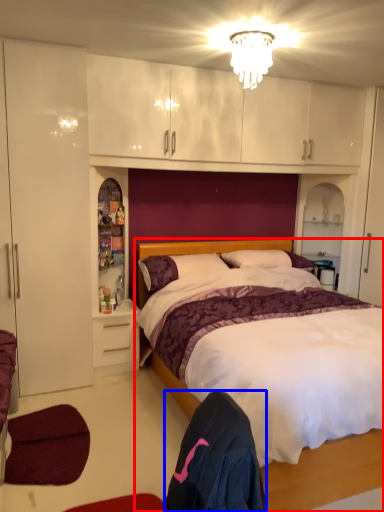
Question: Which of the following is the closest to the observer, bed (highlighted by a red box) or robe (highlighted by a blue box)?

Choices:
 (A) bed
 (B) robe

Answer: (B)